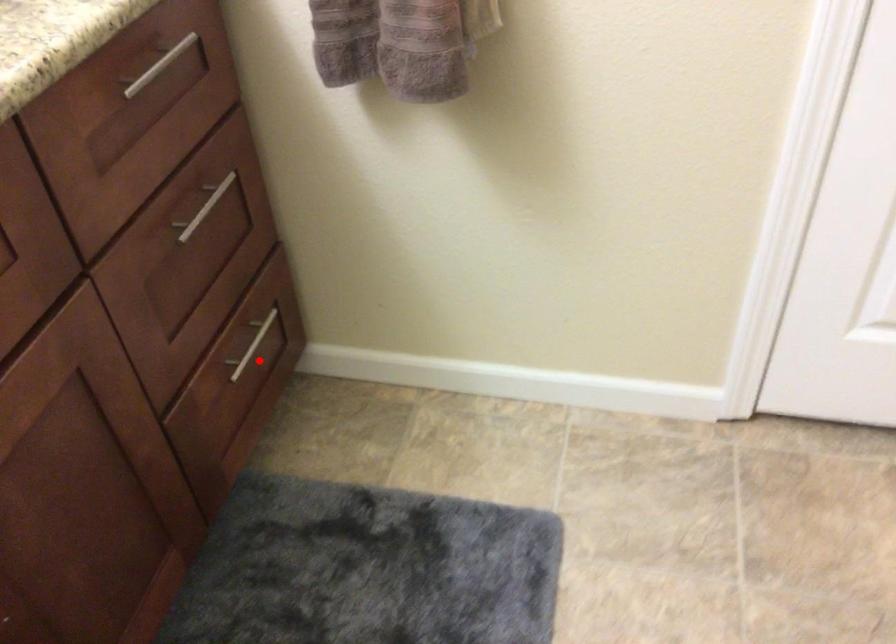
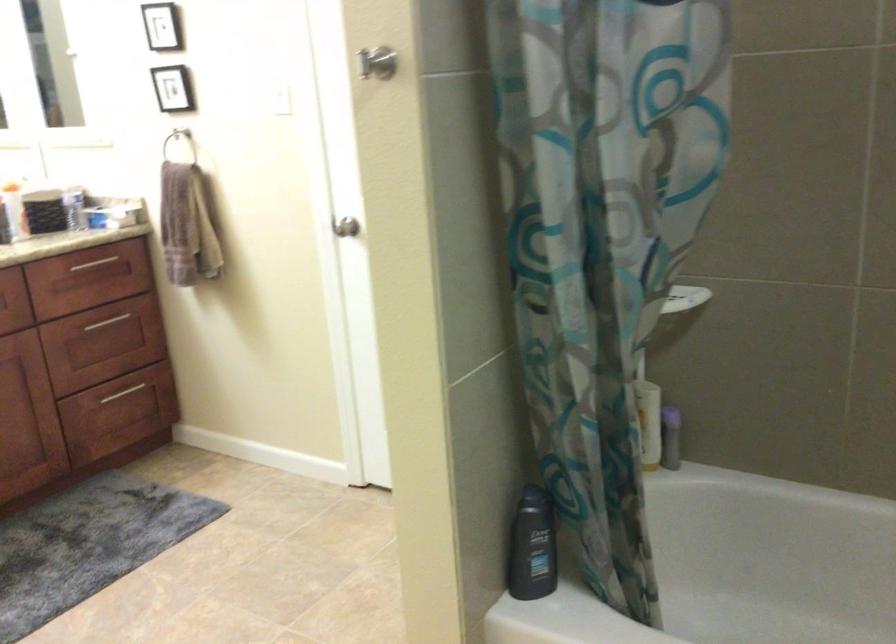
Question: I am providing you with two images of the same scene from different viewpoints. A red point is shown in image1. For the corresponding object point in image2, is it positioned nearer or farther from the camera?

Choices:
 (A) Nearer
 (B) Farther

Answer: (B)